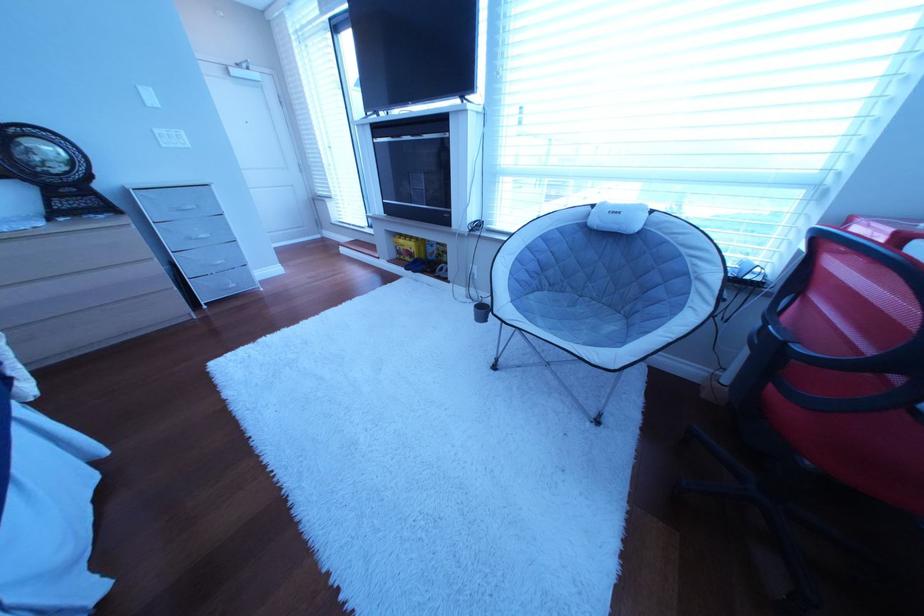
Where is `yellow box`? This screenshot has width=924, height=616. yellow box is located at coordinates (408, 246).